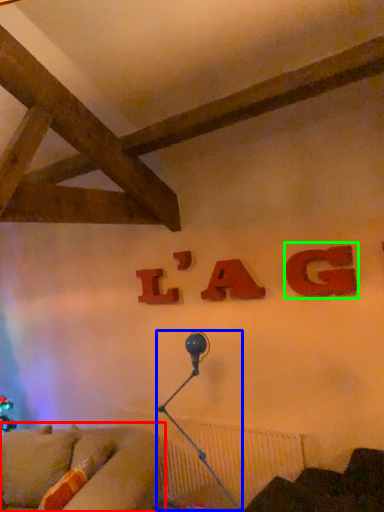
Question: Based on their relative distances, which object is farther from studio couch (highlighted by a red box)? Choose from lamp (highlighted by a blue box) and alphabet (highlighted by a green box).

Choices:
 (A) lamp
 (B) alphabet

Answer: (B)